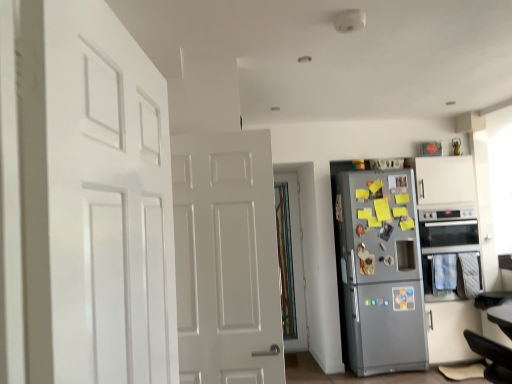
Question: Is silver metallic oven at right oriented towards black leather swivel chair at lower right?

Choices:
 (A) no
 (B) yes

Answer: (B)

Question: Is black leather swivel chair at lower right inside silver metallic oven at right?

Choices:
 (A) no
 (B) yes

Answer: (A)

Question: Is silver metallic oven at right far from black leather swivel chair at lower right?

Choices:
 (A) no
 (B) yes

Answer: (B)

Question: Is silver metallic oven at right turned away from black leather swivel chair at lower right?

Choices:
 (A) yes
 (B) no

Answer: (B)

Question: From a real-world perspective, is silver metallic oven at right positioned over black leather swivel chair at lower right based on gravity?

Choices:
 (A) no
 (B) yes

Answer: (B)

Question: From a real-world perspective, is silver metallic oven at right physically located above or below white matte door at left, arranged as the 1th door when viewed from the front?

Choices:
 (A) above
 (B) below

Answer: (B)

Question: Would you say silver metallic oven at right is to the left or to the right of white matte door at left, arranged as the 1th door when viewed from the front, in the picture?

Choices:
 (A) left
 (B) right

Answer: (B)

Question: From the image's perspective, is silver metallic oven at right above or below white matte door at left, arranged as the 1th door when viewed from the front?

Choices:
 (A) above
 (B) below

Answer: (B)

Question: From their relative heights in the image, would you say silver metallic oven at right is taller or shorter than white matte door at left, arranged as the 1th door when viewed from the front?

Choices:
 (A) tall
 (B) short

Answer: (B)

Question: From the image's perspective, relative to silver metallic oven at right, is black leather swivel chair at lower right above or below?

Choices:
 (A) above
 (B) below

Answer: (B)

Question: Do you think black leather swivel chair at lower right is within silver metallic oven at right, or outside of it?

Choices:
 (A) inside
 (B) outside

Answer: (B)

Question: From a real-world perspective, is black leather swivel chair at lower right above or below silver metallic oven at right?

Choices:
 (A) below
 (B) above

Answer: (A)

Question: Visually, is black leather swivel chair at lower right positioned to the left or to the right of silver metallic oven at right?

Choices:
 (A) left
 (B) right

Answer: (A)

Question: Visually, is white matte door at left, positioned as the 1th door in left-to-right order, positioned to the left or to the right of translucent glass door at center, acting as the 2th door starting from the front?

Choices:
 (A) left
 (B) right

Answer: (A)

Question: From the image's perspective, is white matte door at left, acting as the 2th door starting from the back, above or below translucent glass door at center, marked as the first door in a right-to-left arrangement?

Choices:
 (A) above
 (B) below

Answer: (A)